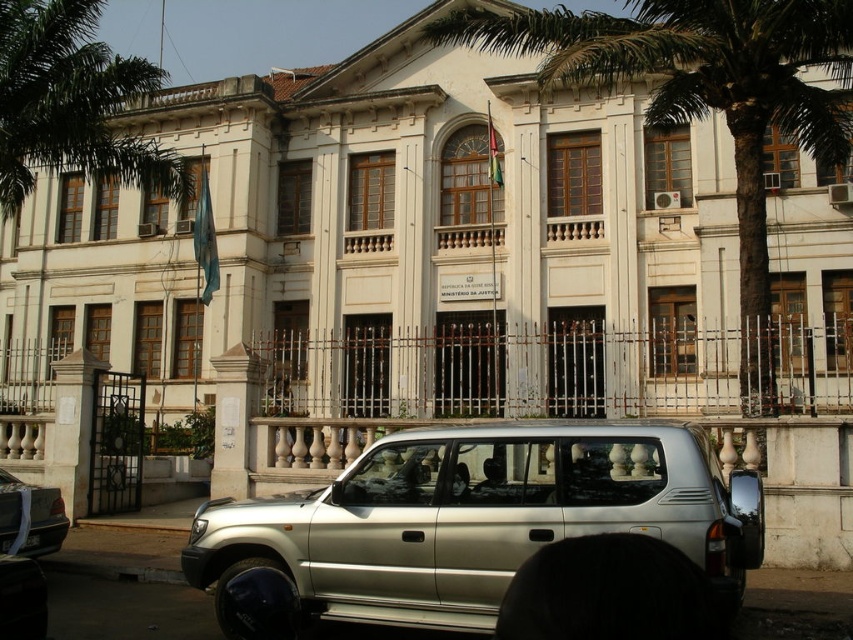
You are a delivery person trying to locate the entrance of the building. You see a green leafy palm tree at upper left and a black plastic license plate at center. How far apart are these two landmarks?

The green leafy palm tree at upper left is 56.74 feet from the black plastic license plate at center.

You are standing at the entrance of the building and want to park your new silver metallic suv at center. The parking spot is located at point (479,518). Is there enough space for your car?

The silver metallic suv at center is already parked at point (479,518), so there is no available space for another vehicle.

Based on the photo, you are standing at the entrance of the building and want to walk towards the point labeled as point (1, 544). Which direction should you move relative to the point labeled point (451, 435)?

You should move away from point (451, 435) because point (451, 435) is in front of point (1, 544), meaning the target point is behind it.